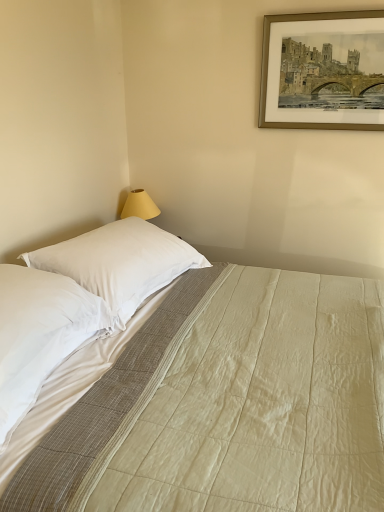
Question: From the image's perspective, is white cotton bed at center over gold metallic picture frame at upper right?

Choices:
 (A) yes
 (B) no

Answer: (B)

Question: Does white cotton bed at center have a lesser height compared to gold metallic picture frame at upper right?

Choices:
 (A) no
 (B) yes

Answer: (A)

Question: Is white cotton bed at center taller than gold metallic picture frame at upper right?

Choices:
 (A) yes
 (B) no

Answer: (A)

Question: Considering the relative sizes of white cotton bed at center and gold metallic picture frame at upper right in the image provided, is white cotton bed at center thinner than gold metallic picture frame at upper right?

Choices:
 (A) yes
 (B) no

Answer: (B)

Question: Is white cotton bed at center beside gold metallic picture frame at upper right?

Choices:
 (A) yes
 (B) no

Answer: (B)

Question: In terms of height, does white cotton bed at center look taller or shorter compared to white soft pillow at left, which is counted as the 2th pillow, starting from the back?

Choices:
 (A) short
 (B) tall

Answer: (B)

Question: Relative to white soft pillow at left, arranged as the first pillow when viewed from the front, is white cotton bed at center in front or behind?

Choices:
 (A) behind
 (B) front

Answer: (B)

Question: From a real-world perspective, is white cotton bed at center physically located above or below white soft pillow at left, arranged as the first pillow when viewed from the front?

Choices:
 (A) below
 (B) above

Answer: (A)

Question: Based on their positions, is white cotton bed at center located to the left or right of white soft pillow at left, which is counted as the 2th pillow, starting from the back?

Choices:
 (A) right
 (B) left

Answer: (A)

Question: Considering the positions of point (266, 100) and point (94, 289), is point (266, 100) closer or farther from the camera than point (94, 289)?

Choices:
 (A) farther
 (B) closer

Answer: (A)

Question: Is gold metallic picture frame at upper right taller or shorter than white smooth pillow at upper left, the 1th pillow from the back?

Choices:
 (A) short
 (B) tall

Answer: (B)

Question: Considering the relative positions of gold metallic picture frame at upper right and white smooth pillow at upper left, the 1th pillow from the back, in the image provided, is gold metallic picture frame at upper right to the left or to the right of white smooth pillow at upper left, the 1th pillow from the back,?

Choices:
 (A) right
 (B) left

Answer: (A)

Question: From a real-world perspective, is gold metallic picture frame at upper right positioned above or below white smooth pillow at upper left, which appears as the 2th pillow when viewed from the front?

Choices:
 (A) above
 (B) below

Answer: (A)

Question: From a real-world perspective, is white cotton bed at center physically located above or below gold metallic picture frame at upper right?

Choices:
 (A) above
 (B) below

Answer: (B)

Question: Considering the positions of white cotton bed at center and gold metallic picture frame at upper right in the image, is white cotton bed at center wider or thinner than gold metallic picture frame at upper right?

Choices:
 (A) wide
 (B) thin

Answer: (A)